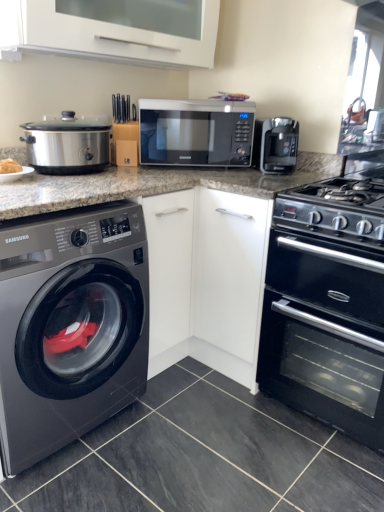
This screenshot has height=512, width=384. Describe the element at coordinates (70, 326) in the screenshot. I see `satin black washing machine at left` at that location.

Find the location of `satin silver microwave at center`. satin silver microwave at center is located at coordinates (196, 133).

Locate an element on the screen. The height and width of the screenshot is (512, 384). white glossy vent at upper center is located at coordinates (112, 30).

You are a GUI agent. You are given a task and a screenshot of the screen. Output one action in this format:
    pyautogui.click(x=<x>, y=<y>)
    Task: Click on the black metallic gas stove at right
    
    Given the screenshot: What is the action you would take?
    pyautogui.click(x=336, y=210)

Locate an element on the screen. The height and width of the screenshot is (512, 384). black matte oven at lower right is located at coordinates (325, 334).

Find the location of `satin black washing machine at left`. satin black washing machine at left is located at coordinates (70, 326).

Measure the distance between satin black washing machine at left and white glossy vent at upper center.

satin black washing machine at left and white glossy vent at upper center are 37.59 inches apart.

Is satin black washing machine at left closer to camera compared to white glossy vent at upper center?

Yes, the depth of satin black washing machine at left is less than that of white glossy vent at upper center.

Would you say satin black washing machine at left is outside white glossy vent at upper center?

Yes, satin black washing machine at left is located beyond the bounds of white glossy vent at upper center.

Locate an element on the screen. vent on the right side of satin black washing machine at left is located at coordinates (112, 30).

In terms of height, does satin silver microwave at center look taller or shorter compared to satin black washing machine at left?

Clearly, satin silver microwave at center is shorter compared to satin black washing machine at left.

Which object is positioned more to the right, satin silver microwave at center or satin black washing machine at left?

Positioned to the right is satin silver microwave at center.

From the image's perspective, is satin silver microwave at center above satin black washing machine at left?

Yes.

Is satin silver microwave at center not close to satin black washing machine at left?

Answer: They are positioned close to each other.

Measure the distance from black metallic gas stove at right to black matte oven at lower right.

black metallic gas stove at right is 11.54 inches away from black matte oven at lower right.

Considering the relative positions of black metallic gas stove at right and black matte oven at lower right in the image provided, is black metallic gas stove at right to the right of black matte oven at lower right from the viewer's perspective?

No, black metallic gas stove at right is not to the right of black matte oven at lower right.

How many degrees apart are the facing directions of black metallic gas stove at right and black matte oven at lower right?

The angular difference between black metallic gas stove at right and black matte oven at lower right is 0.000379 degrees.

Can you confirm if black metallic gas stove at right is smaller than black matte oven at lower right?

Result: Yes, black metallic gas stove at right is smaller than black matte oven at lower right.

Is satin black washing machine at left not within satin black coffee maker at upper right?

Yes, satin black washing machine at left is outside of satin black coffee maker at upper right.

Which is closer to the camera, [49,253] or [274,150]?

Point [49,253] is closer to the camera than point [274,150].

From a real-world perspective, is satin black washing machine at left located higher than satin black coffee maker at upper right?

No, from a real-world perspective, satin black washing machine at left is not on top of satin black coffee maker at upper right.

At what (x,y) coordinates should I click in order to perform the action: click on coffee machine on the right of satin black washing machine at left. Please return your answer as a coordinate pair (x, y). Looking at the image, I should click on (278, 145).

Is white glossy vent at upper center a part of satin silver microwave at center?

No, white glossy vent at upper center is not a part of satin silver microwave at center.

Is satin silver microwave at center bigger than white glossy vent at upper center?

Incorrect, satin silver microwave at center is not larger than white glossy vent at upper center.

Considering the positions of objects satin silver microwave at center and white glossy vent at upper center in the image provided, who is more to the left, satin silver microwave at center or white glossy vent at upper center?

From the viewer's perspective, white glossy vent at upper center appears more on the left side.

Is satin silver microwave at center shorter than white glossy vent at upper center?

Yes.

Between stainless steel slow cooker at left and white glossy vent at upper center, which one has more height?

With more height is white glossy vent at upper center.

Can you confirm if stainless steel slow cooker at left is positioned to the left of white glossy vent at upper center?

Correct, you'll find stainless steel slow cooker at left to the left of white glossy vent at upper center.

Does stainless steel slow cooker at left have a smaller size compared to white glossy vent at upper center?

Yes, stainless steel slow cooker at left is smaller than white glossy vent at upper center.

Would you say stainless steel slow cooker at left is inside or outside white glossy vent at upper center?

The correct answer is: outside.

Looking at this image, which is nearer, (97, 325) or (203, 161)?

Point (97, 325) appears to be closer to the viewer than point (203, 161).

From a real-world perspective, which object stands above the other?

From a 3D spatial view, satin silver microwave at center is above.

Is satin black washing machine at left to the left of satin silver microwave at center from the viewer's perspective?

Yes, satin black washing machine at left is to the left of satin silver microwave at center.

Is satin black washing machine at left positioned with its back to satin silver microwave at center?

satin black washing machine at left is not turned away from satin silver microwave at center.

Locate an element on the screen. Image resolution: width=384 pixels, height=512 pixels. washing machine to the left of white glossy vent at upper center is located at coordinates (70, 326).

Locate an element on the screen. microwave oven that appears above the satin black washing machine at left (from the image's perspective) is located at coordinates (196, 133).

From the image, which object appears to be farther from white glossy vent at upper center, black matte oven at lower right or black metallic gas stove at right?

black matte oven at lower right is further to white glossy vent at upper center.

From the image, which object appears to be farther from white glossy vent at upper center, satin black coffee maker at upper right or black matte oven at lower right?

Based on the image, black matte oven at lower right appears to be further to white glossy vent at upper center.

Looking at the image, which one is located closer to satin black coffee maker at upper right, white glossy vent at upper center or satin black washing machine at left?

Among the two, white glossy vent at upper center is located nearer to satin black coffee maker at upper right.

Which object lies further to the anchor point satin silver microwave at center, black metallic gas stove at right or black matte oven at lower right?

Among the two, black matte oven at lower right is located further to satin silver microwave at center.

From the image, which object appears to be farther from white glossy vent at upper center, satin black washing machine at left or black metallic gas stove at right?

black metallic gas stove at right is further to white glossy vent at upper center.

Looking at the image, which one is located closer to black matte oven at lower right, stainless steel slow cooker at left or satin black washing machine at left?

satin black washing machine at left lies closer to black matte oven at lower right than the other object.

Estimate the real-world distances between objects in this image. Which object is further from satin black washing machine at left, black metallic gas stove at right or white glossy vent at upper center?

white glossy vent at upper center.

Based on their spatial positions, is stainless steel slow cooker at left or black metallic gas stove at right closer to satin black washing machine at left?

stainless steel slow cooker at left lies closer to satin black washing machine at left than the other object.

Locate an element on the screen. coffee machine situated between white glossy vent at upper center and black metallic gas stove at right from left to right is located at coordinates (278, 145).

Where is `coffee machine between white glossy vent at upper center and black matte oven at lower right in the vertical direction`? This screenshot has height=512, width=384. coffee machine between white glossy vent at upper center and black matte oven at lower right in the vertical direction is located at coordinates (278, 145).

Locate an element on the screen. The width and height of the screenshot is (384, 512). coffee machine between satin black washing machine at left and black metallic gas stove at right is located at coordinates (278, 145).

Where is `coffee machine between stainless steel slow cooker at left and black matte oven at lower right`? Image resolution: width=384 pixels, height=512 pixels. coffee machine between stainless steel slow cooker at left and black matte oven at lower right is located at coordinates (278, 145).